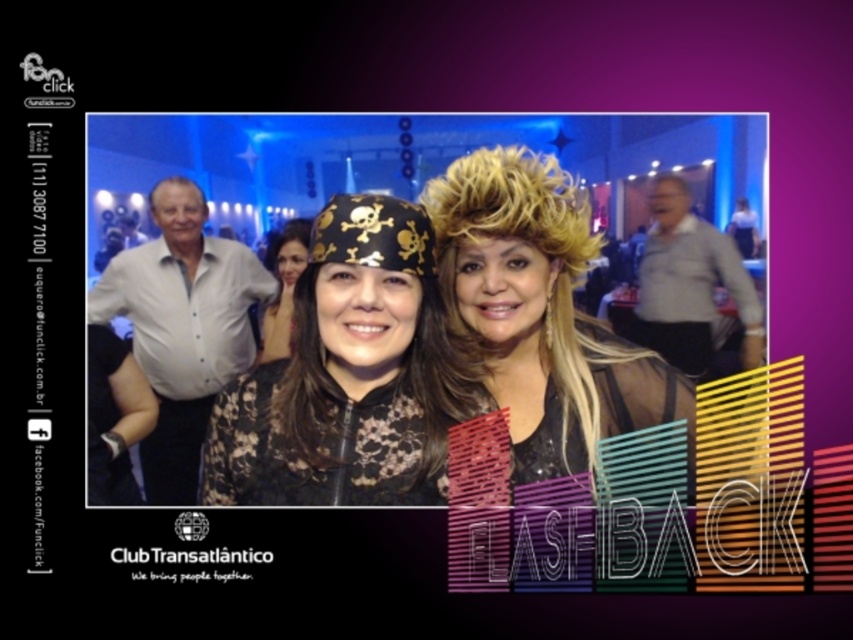
Question: Observing the image, what is the correct spatial positioning of black lace dress at center in reference to gray cotton shirt at right?

Choices:
 (A) right
 (B) left

Answer: (B)

Question: Which of these objects is positioned closest to the blonde hair at center?

Choices:
 (A) matte black headscarf at center
 (B) white cotton shirt at left
 (C) gray cotton shirt at right

Answer: (C)

Question: Is the position of blonde hair at center less distant than that of matte black headscarf at center?

Choices:
 (A) no
 (B) yes

Answer: (B)

Question: Which point appears farthest from the camera in this image?

Choices:
 (A) (645, 326)
 (B) (170, 308)
 (C) (329, 360)
 (D) (529, 262)

Answer: (A)

Question: Which of the following is the closest to the observer?

Choices:
 (A) (186, 324)
 (B) (757, 323)
 (C) (614, 392)

Answer: (B)

Question: Does gray cotton shirt at right come in front of matte black headscarf at center?

Choices:
 (A) no
 (B) yes

Answer: (B)